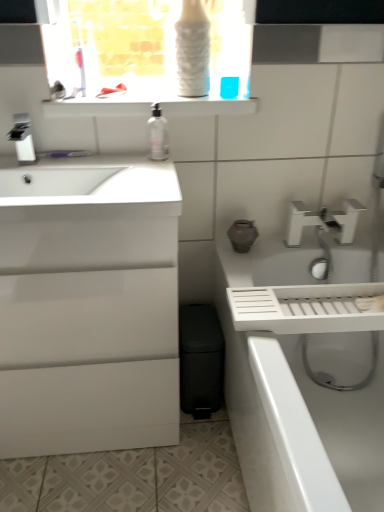
Find the location of a particular element. free point above white glossy shelf at upper center (from a real-world perspective) is located at coordinates (135, 94).